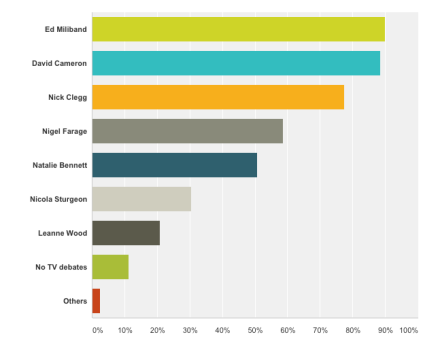
Identify the location of light grey bar. (175, 200).